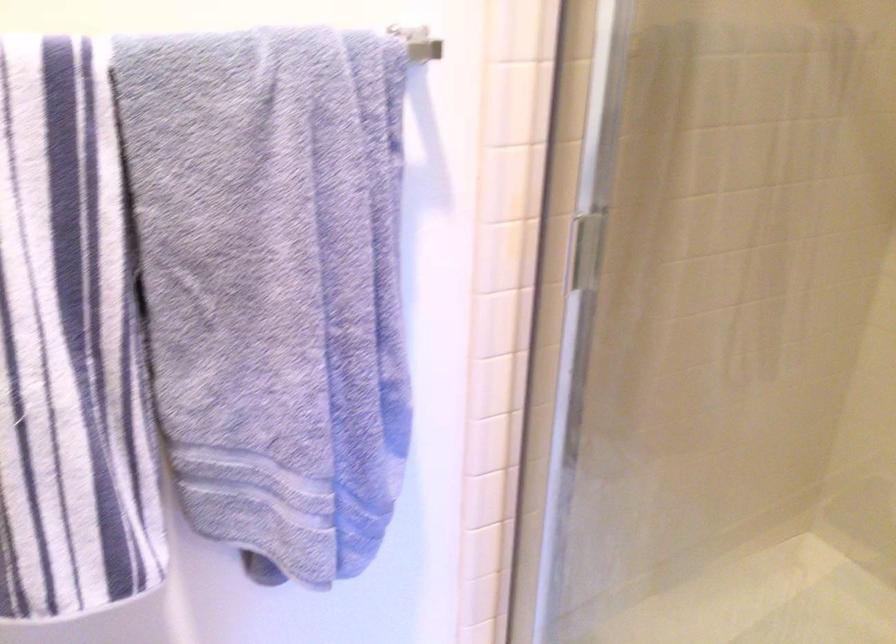
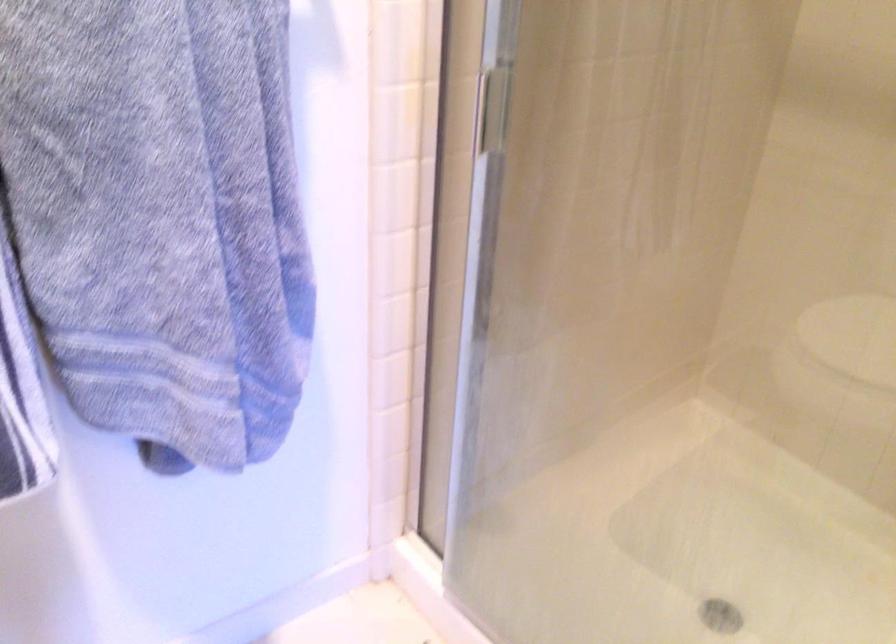
Question: The first image is from the beginning of the video and the second image is from the end. How did the camera likely rotate when shooting the video?

Choices:
 (A) Left
 (B) Right
 (C) Up
 (D) Down

Answer: (B)